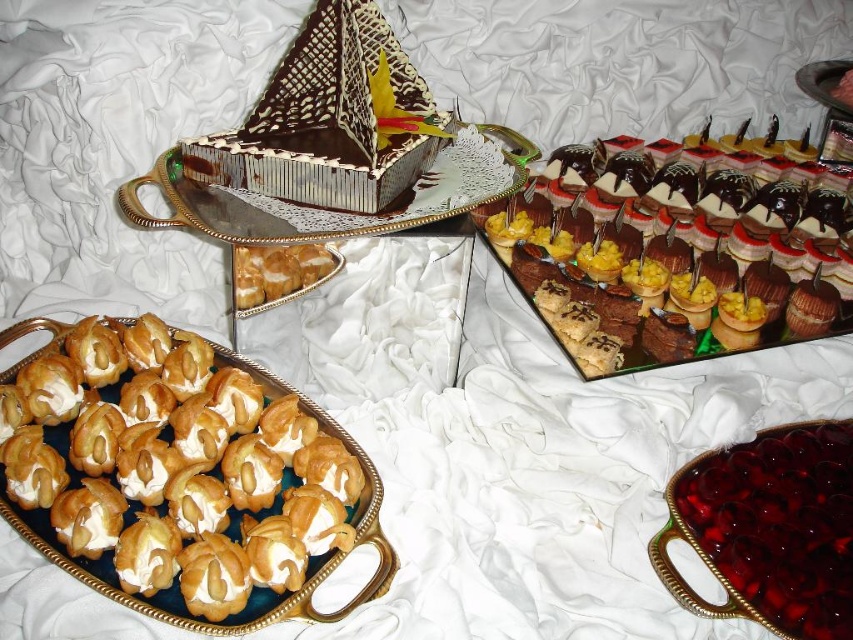
Looking at this image, you are a guest at a dessert table and want to choose a dessert that is taller than the other. Which one should you pick between the golden cream puff at lower left and the golden puff pastry at left?

The golden cream puff at lower left is much taller than the golden puff pastry at left, so you should pick the golden cream puff at lower left.